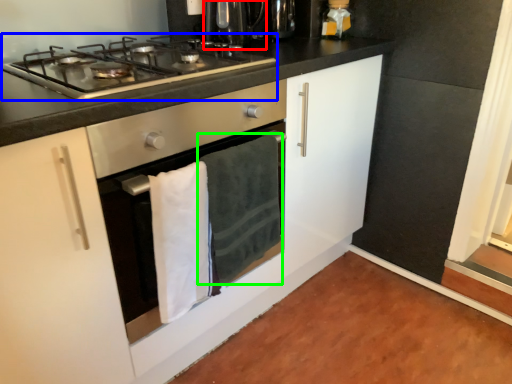
Question: Which object is the closest to the coffee machine (highlighted by a red box)? Choose among these: gas stove (highlighted by a blue box) or bath towel (highlighted by a green box).

Choices:
 (A) gas stove
 (B) bath towel

Answer: (A)